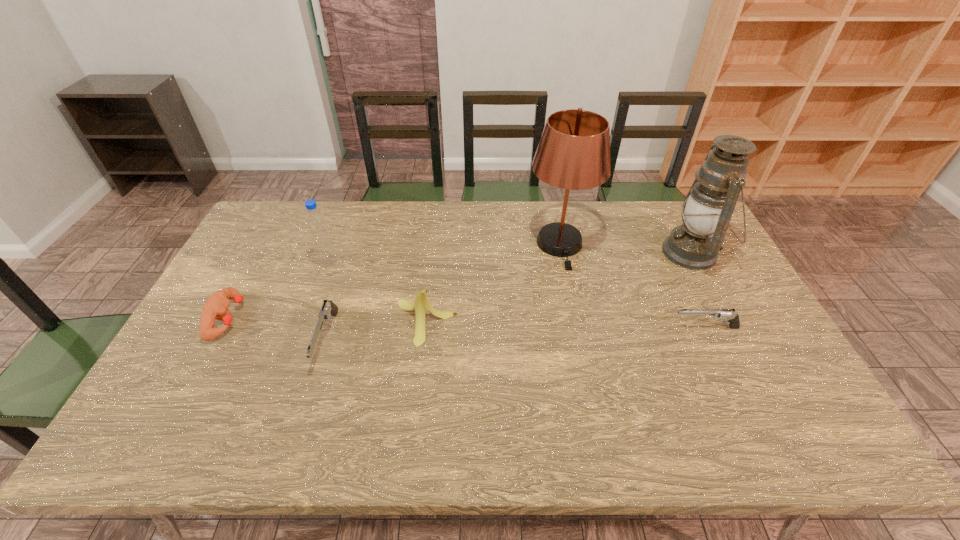
The width and height of the screenshot is (960, 540). What are the coordinates of `free space that is in between the shorter pistol and the puncher` in the screenshot? It's located at (467, 323).

You are a GUI agent. You are given a task and a screenshot of the screen. Output one action in this format:
    pyautogui.click(x=<x>, y=<y>)
    Task: Click on the free point between the puncher and the lampshade
    
    Given the screenshot: What is the action you would take?
    pyautogui.click(x=394, y=281)

Where is `unoccupied position between the oil lamp and the shorter pistol`? unoccupied position between the oil lamp and the shorter pistol is located at coordinates (699, 290).

Find the location of a particular element. This screenshot has width=960, height=540. unoccupied area between the puncher and the shorter pistol is located at coordinates (467, 323).

The height and width of the screenshot is (540, 960). Identify the location of vacant region between the right pistol and the sixth object from right to left. (516, 295).

The image size is (960, 540). What are the coordinates of `free space between the fourth shortest object and the water bottle` in the screenshot? It's located at (377, 292).

This screenshot has height=540, width=960. Identify the location of free area in between the water bottle and the third object from right to left. (444, 253).

I want to click on blank region between the water bottle and the fourth object from left to right, so click(x=377, y=292).

Identify the location of vacant area between the oil lamp and the leftmost object. Image resolution: width=960 pixels, height=540 pixels. (460, 286).

This screenshot has height=540, width=960. In order to click on free spot between the oil lamp and the right pistol in this screenshot , I will do `click(699, 290)`.